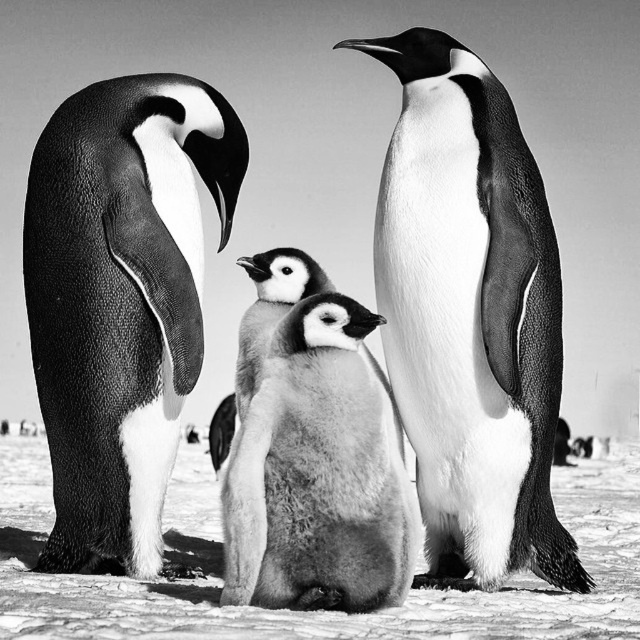
Question: Does soft gray feathers at left appear on the right side of soft yellow down at center?

Choices:
 (A) yes
 (B) no

Answer: (B)

Question: Which point is closer to the camera taking this photo?

Choices:
 (A) (273, 264)
 (B) (461, 410)
 (C) (380, 572)
 (D) (38, 144)

Answer: (C)

Question: Which of the following is the closest to the observer?

Choices:
 (A) soft gray feathers at left
 (B) soft gray down at center

Answer: (B)

Question: Is soft gray feathers at left smaller than soft gray down feathers at center?

Choices:
 (A) yes
 (B) no

Answer: (B)

Question: Which object is closer to the camera taking this photo?

Choices:
 (A) white fluffy snow at center
 (B) smooth black penguin at center

Answer: (A)

Question: Is soft gray feathers at left positioned before soft yellow down at center?

Choices:
 (A) yes
 (B) no

Answer: (A)